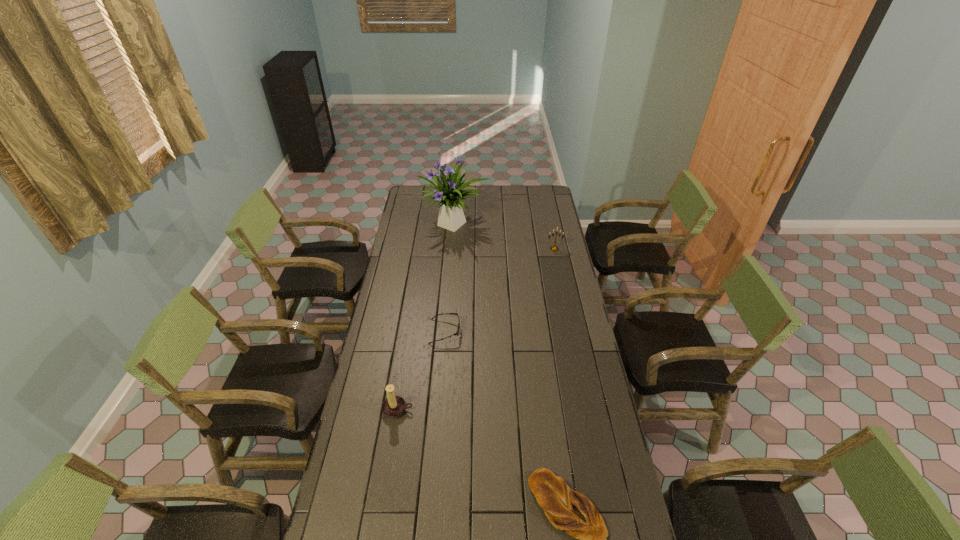
Locate an element on the screen. The image size is (960, 540). candle holder present at the left edge is located at coordinates [393, 406].

The height and width of the screenshot is (540, 960). What are the coordinates of `object situated at the right edge` in the screenshot? It's located at (553, 248).

The width and height of the screenshot is (960, 540). I want to click on free location at the far edge of the desktop, so click(517, 186).

I want to click on vacant space at the left edge of the desktop, so click(378, 318).

Where is `vacant region at the right edge of the desktop`? The image size is (960, 540). vacant region at the right edge of the desktop is located at coordinates (561, 221).

The height and width of the screenshot is (540, 960). In the image, there is a desktop. Identify the location of vacant space at the far right corner. (543, 195).

You are a GUI agent. You are given a task and a screenshot of the screen. Output one action in this format:
    pyautogui.click(x=<x>, y=<y>)
    Task: Click on the empty location between the flower arrangement and the sunglasses
    
    Given the screenshot: What is the action you would take?
    [450, 278]

Image resolution: width=960 pixels, height=540 pixels. I want to click on unoccupied position between the third nearest object and the flower arrangement, so click(x=450, y=278).

Find the location of `free space between the third farthest object and the left candelabrum`. free space between the third farthest object and the left candelabrum is located at coordinates (421, 370).

At what (x,y) coordinates should I click in order to perform the action: click on vacant space that is in between the sunglasses and the farther candelabrum. Please return your answer as a coordinate pair (x, y). The height and width of the screenshot is (540, 960). Looking at the image, I should click on (499, 290).